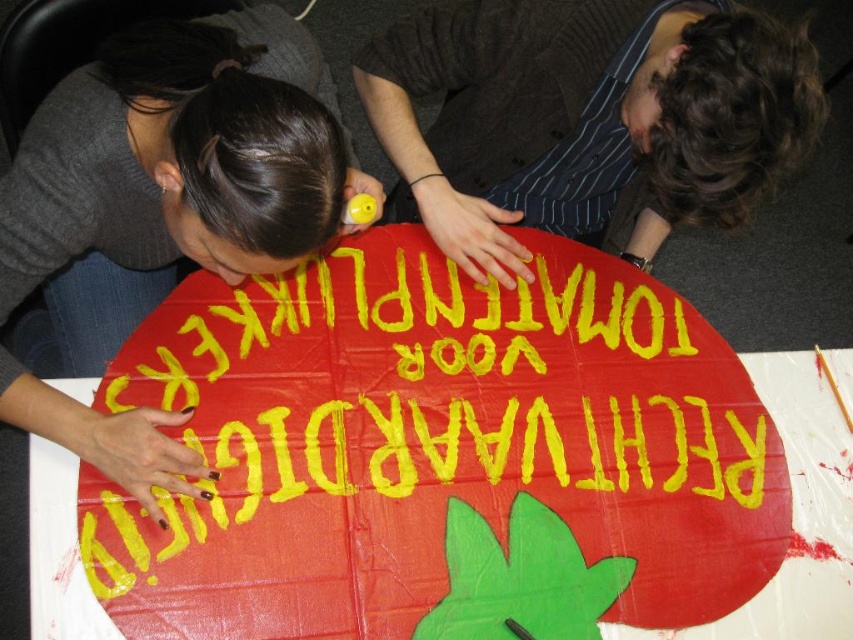
You are a photographer trying to capture the scene of the two people making the poster. You want to ensure both the matte cardboard sign at center and the dark brown striped shirt at upper center are clearly visible in your photo. Based on their positions, where should you position your camera to include both elements in the frame?

To capture both the matte cardboard sign at center and the dark brown striped shirt at upper center, position the camera above the matte cardboard sign at center so that the dark brown striped shirt at upper center is visible above it. Since the matte cardboard sign at center is below the dark brown striped shirt at upper center, this angle will ensure both are in the frame.

You are a photographer trying to capture the entire matte cardboard sign at center and the dark brown striped shirt at upper center in one frame. Based on their sizes, will the sign likely occupy more of the photo than the shirt?

The matte cardboard sign at center might be wider than dark brown striped shirt at upper center, so it is possible that the sign will take up more space in the photo than the shirt.